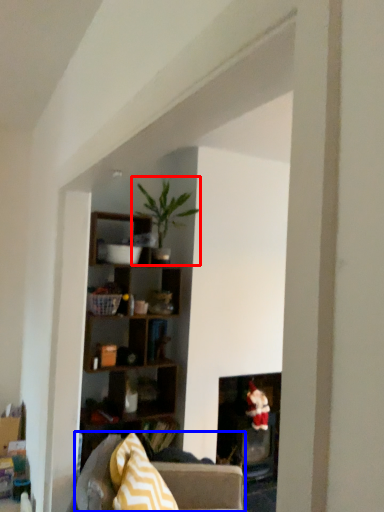
Question: Which point is further to the camera, houseplant (highlighted by a red box) or studio couch (highlighted by a blue box)?

Choices:
 (A) houseplant
 (B) studio couch

Answer: (A)